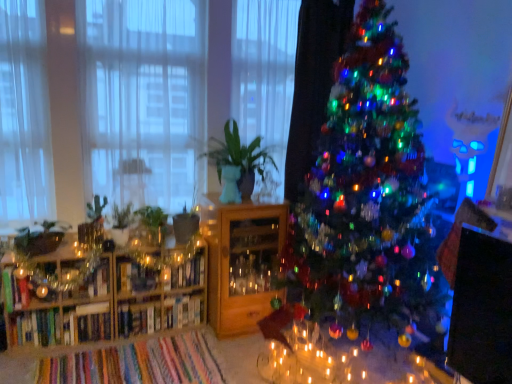
Question: In the image, is green matte plant at center positioned in front of or behind metallic glass shelf at left, which is the 1th shelf in left-to-right order?

Choices:
 (A) behind
 (B) front

Answer: (B)

Question: Is green matte plant at center bigger or smaller than metallic glass shelf at left, acting as the 2th shelf starting from the right?

Choices:
 (A) small
 (B) big

Answer: (B)

Question: Estimate the real-world distances between objects in this image. Which object is farther from the green matte plant at center?

Choices:
 (A) hardcover book at center, which is the 1th book from right to left
 (B) white sheer curtain at left, positioned as the 1th curtain in left-to-right order
 (C) white sheer curtain at left, the 2th curtain from the right
 (D) metallic glass shelf at left, which is the 1th shelf in left-to-right order
 (E) wooden cabinet at center, the 1th shelf viewed from the right

Answer: (B)

Question: Which object is the farthest from the hardcover book at center, placed as the second book when sorted from left to right?

Choices:
 (A) wooden cabinet at center, which ranks as the second shelf in left-to-right order
 (B) wooden bookshelf at left
 (C) green matte plant at center
 (D) iridescent glass christmas tree at center
 (E) hardcover book at center, positioned as the 1th book in left-to-right order

Answer: (D)